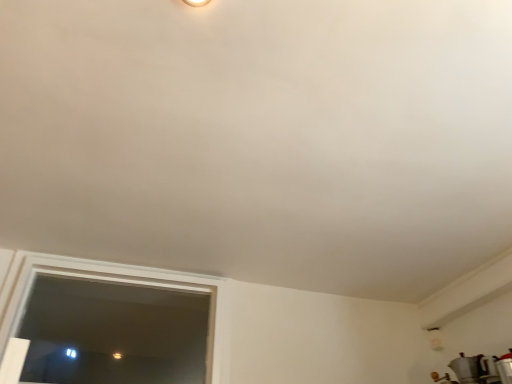
Where is `transparent glass window at lower left`? Image resolution: width=512 pixels, height=384 pixels. transparent glass window at lower left is located at coordinates (124, 283).

Describe the element at coordinates (124, 283) in the screenshot. This screenshot has height=384, width=512. I see `transparent glass window at lower left` at that location.

I want to click on transparent glass window at lower left, so click(x=124, y=283).